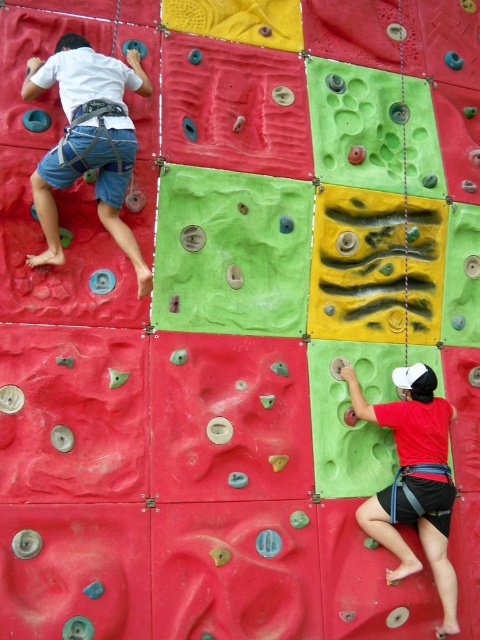
Describe the element at coordinates (88, 140) in the screenshot. I see `matte white climbing harness at upper left` at that location.

Does matte white climbing harness at upper left have a larger size compared to matte red shorts at lower right?

Correct, matte white climbing harness at upper left is larger in size than matte red shorts at lower right.

Locate an element on the screen. The image size is (480, 640). matte white climbing harness at upper left is located at coordinates (88, 140).